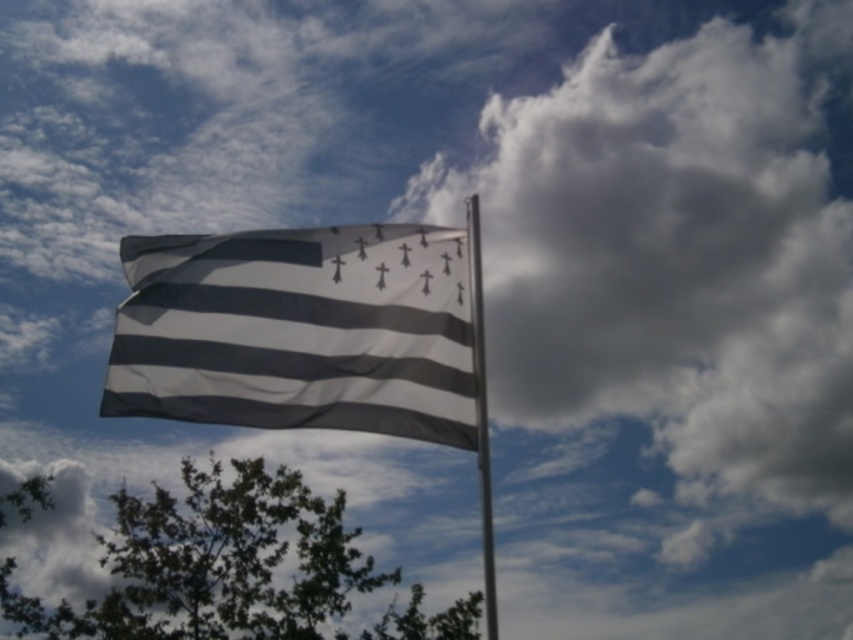
Based on the photo, does black and white striped flag at center appear on the left side of green leafy tree at lower left?

In fact, black and white striped flag at center is to the right of green leafy tree at lower left.

Can you confirm if black and white striped flag at center is positioned above green leafy tree at lower left?

Indeed, black and white striped flag at center is positioned over green leafy tree at lower left.

Describe the element at coordinates (299, 330) in the screenshot. I see `black and white striped flag at center` at that location.

You are a GUI agent. You are given a task and a screenshot of the screen. Output one action in this format:
    pyautogui.click(x=<x>, y=<y>)
    Task: Click on the black and white striped flag at center
    Image resolution: width=853 pixels, height=640 pixels.
    Given the screenshot: What is the action you would take?
    pyautogui.click(x=299, y=330)

Can you confirm if green leafy tree at lower left is bigger than metallic pole at center?

Indeed, green leafy tree at lower left has a larger size compared to metallic pole at center.

Is green leafy tree at lower left to the right of metallic pole at center from the viewer's perspective?

In fact, green leafy tree at lower left is to the left of metallic pole at center.

Who is more distant from viewer, (x=318, y=541) or (x=489, y=524)?

Positioned behind is point (x=318, y=541).

The width and height of the screenshot is (853, 640). Find the location of `green leafy tree at lower left`. green leafy tree at lower left is located at coordinates (213, 563).

Is point (461, 360) positioned before point (473, 282)?

That is True.

Which is behind, point (401, 344) or point (492, 602)?

Point (401, 344)

I want to click on black and white striped flag at center, so click(299, 330).